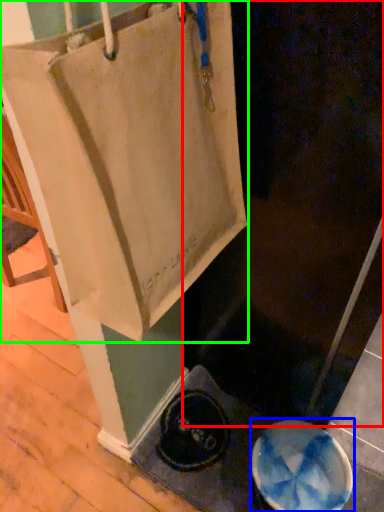
Question: Which object is the farthest from screen door (highlighted by a red box)? Choose among these: manhole cover (highlighted by a blue box) or tote bag (highlighted by a green box).

Choices:
 (A) manhole cover
 (B) tote bag

Answer: (A)